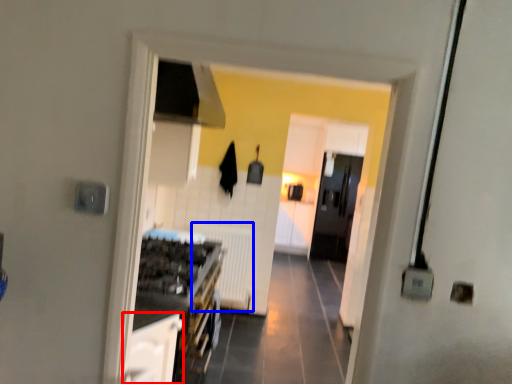
Question: Which object appears farthest to the camera in this image, cabinetry (highlighted by a red box) or radiator (highlighted by a blue box)?

Choices:
 (A) cabinetry
 (B) radiator

Answer: (B)